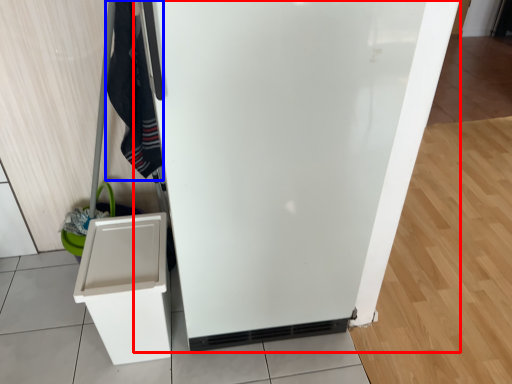
Question: Which point is further to the camera, refrigerator (highlighted by a red box) or clothing (highlighted by a blue box)?

Choices:
 (A) refrigerator
 (B) clothing

Answer: (B)